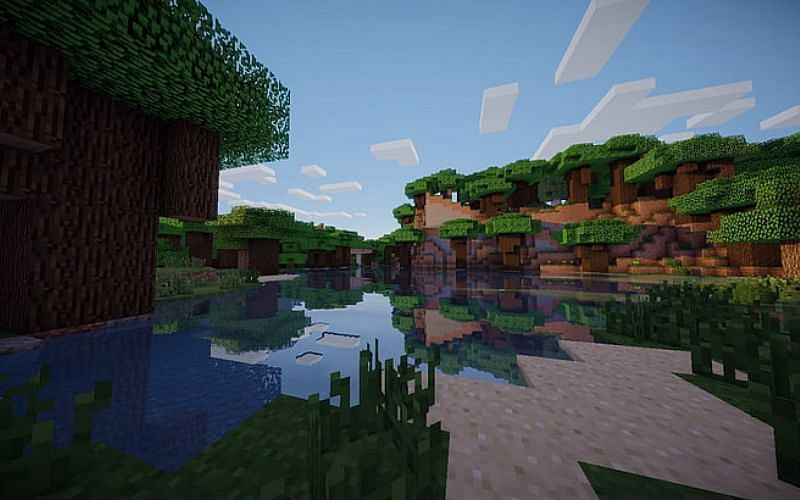
This screenshot has width=800, height=500. Identify the location of green plant. (414, 395), (378, 399), (345, 403), (652, 313), (702, 309), (745, 312).